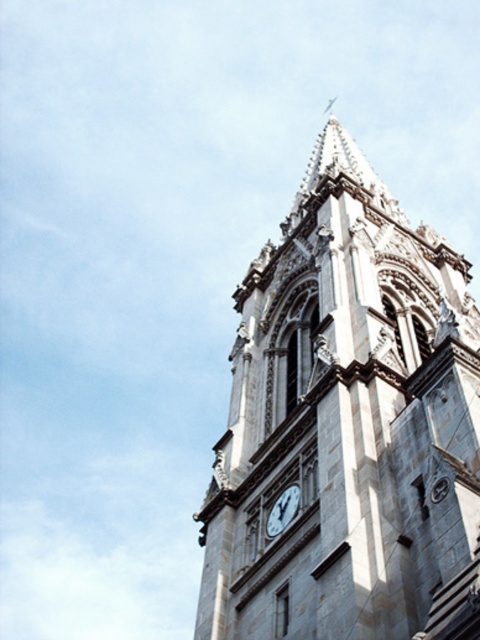
You are an architect designing a new city square and want to place a new statue between the white stone clock tower at center and the white marble clock at center. The statue requires a minimum of 2 meters of space between it and each object. Given the current spacing between the two objects, can the statue be placed between them?

The white stone clock tower at center is wider than the white marble clock at center, but the description does not provide information about the distance between them. Without knowing the actual spacing between the two objects, it is impossible to determine if the statue can be placed between them with the required 2 meters of space on each side.

You are standing in front of the church and want to take a photo of both the white stone clock tower at center and the white marble clock at center. Which one will appear higher in your camera view?

The white stone clock tower at center is above the white marble clock at center, so the white stone clock tower at center will appear higher in your camera view.

You are an architect designing a new city square and want to place a statue between the white stone clock tower at center and the white marble clock at center. Since the statue will be placed equidistant from both, which object should you use as the reference point to ensure the statue is centered between them?

The statue should be placed equidistant from both the white stone clock tower at center and the white marble clock at center. Since the white stone clock tower at center is larger in size than the white marble clock at center, you should use the center point of the larger tower as the reference to ensure proper alignment.